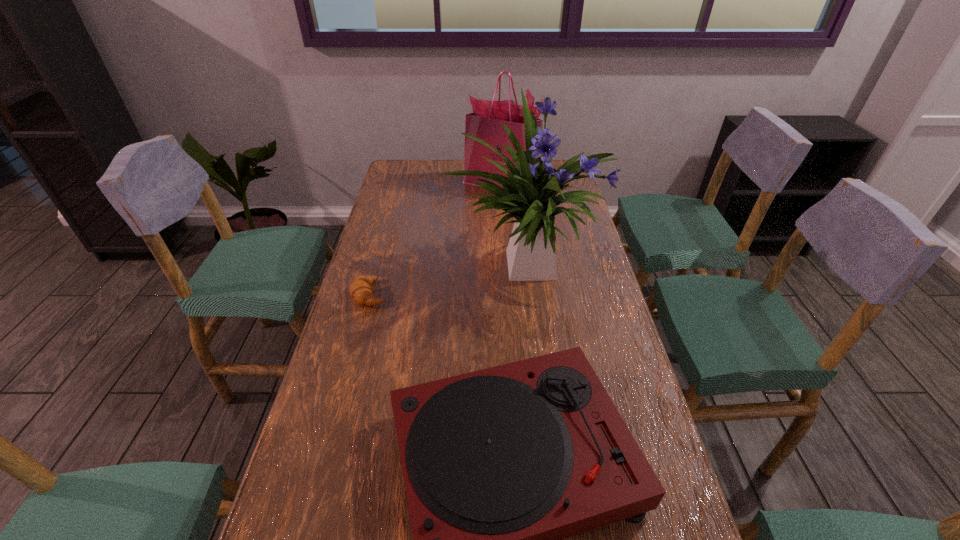
Locate an element on the screen. The width and height of the screenshot is (960, 540). flower arrangement is located at coordinates (529, 194).

This screenshot has height=540, width=960. In order to click on the farthest object in this screenshot , I will do `click(485, 123)`.

At what (x,y) coordinates should I click in order to perform the action: click on the third shortest object. Please return your answer as a coordinate pair (x, y). The height and width of the screenshot is (540, 960). Looking at the image, I should click on (485, 123).

Find the location of a particular element. This screenshot has width=960, height=540. the shortest object is located at coordinates (360, 289).

At what (x,y) coordinates should I click in order to perform the action: click on crescent roll. Please return your answer as a coordinate pair (x, y). Image resolution: width=960 pixels, height=540 pixels. Looking at the image, I should click on point(360,289).

You are a GUI agent. You are given a task and a screenshot of the screen. Output one action in this format:
    pyautogui.click(x=<x>, y=<y>)
    Task: Click on the free space located on the left of the flower arrangement
    The height and width of the screenshot is (540, 960).
    Given the screenshot: What is the action you would take?
    pyautogui.click(x=403, y=264)

Locate an element on the screen. This screenshot has height=540, width=960. free location located 0.300m on the left of the third shortest object is located at coordinates (387, 184).

Find the location of a particular element. vacant point located 0.330m on the back of the shortest object is located at coordinates (391, 218).

Where is `object situated at the far edge`? object situated at the far edge is located at coordinates (485, 123).

The width and height of the screenshot is (960, 540). What are the coordinates of `object that is positioned at the left edge` in the screenshot? It's located at (360, 289).